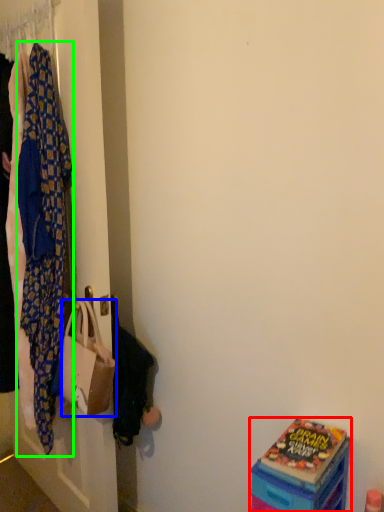
Question: Based on their relative distances, which object is farther from box (highlighted by a red box)? Choose from handbag (highlighted by a blue box) and blanket (highlighted by a green box).

Choices:
 (A) handbag
 (B) blanket

Answer: (B)